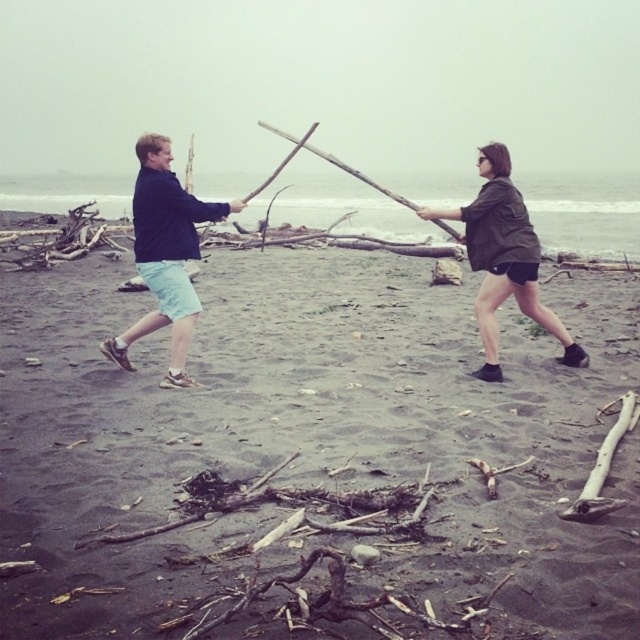
Between light blue shorts at left and matte green jacket at center, which one appears on the right side from the viewer's perspective?

From the viewer's perspective, matte green jacket at center appears more on the right side.

Does light blue shorts at left have a lesser width compared to matte green jacket at center?

Indeed, light blue shorts at left has a lesser width compared to matte green jacket at center.

Which is behind, point (140, 236) or point (472, 218)?

Positioned behind is point (472, 218).

Find the location of a particular element. The width and height of the screenshot is (640, 640). light blue shorts at left is located at coordinates (164, 253).

Does dark sand driftwood at center have a lesser width compared to light blue shorts at left?

No.

Based on the photo, is dark sand driftwood at center further to the viewer compared to light blue shorts at left?

No, it is in front of light blue shorts at left.

Find the location of `dark sand driftwood at center`. dark sand driftwood at center is located at coordinates (307, 449).

Is dark sand driftwood at center to the right of matte green jacket at center from the viewer's perspective?

In fact, dark sand driftwood at center is to the left of matte green jacket at center.

Is point (376, 612) less distant than point (508, 216)?

Yes, it is.

Locate an element on the screen. The height and width of the screenshot is (640, 640). dark sand driftwood at center is located at coordinates 307,449.